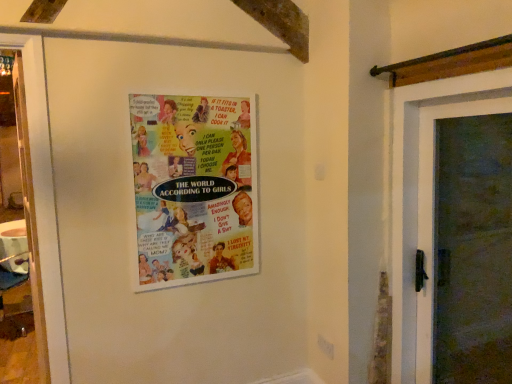
The height and width of the screenshot is (384, 512). Identify the location of multicolored paper poster at center. (194, 189).

In order to face multicolored paper poster at center, should I rotate leftwards or rightwards?

Turn left approximately 7.972 degrees to face it.

Describe the element at coordinates (194, 189) in the screenshot. The width and height of the screenshot is (512, 384). I see `multicolored paper poster at center` at that location.

The width and height of the screenshot is (512, 384). Describe the element at coordinates (425, 201) in the screenshot. I see `wooden door at right` at that location.

Find the location of a particular element. The width and height of the screenshot is (512, 384). wooden door at right is located at coordinates (425, 201).

This screenshot has width=512, height=384. Find the location of `multicolored paper poster at center`. multicolored paper poster at center is located at coordinates (194, 189).

Visually, is wooden door at right positioned to the left or to the right of multicolored paper poster at center?

Clearly, wooden door at right is on the right of multicolored paper poster at center in the image.

Is wooden door at right in front of or behind multicolored paper poster at center in the image?

Visually, wooden door at right is located in front of multicolored paper poster at center.

Which is in front, point (431, 205) or point (145, 250)?

The point (431, 205) is closer to the camera.

From the image's perspective, which one is positioned lower, wooden door at right or multicolored paper poster at center?

wooden door at right, from the image's perspective.

From a real-world perspective, is wooden door at right below multicolored paper poster at center?

Yes, from a real-world perspective, wooden door at right is under multicolored paper poster at center.

Considering the sizes of wooden door at right and multicolored paper poster at center in the image, is wooden door at right wider or thinner than multicolored paper poster at center?

Clearly, wooden door at right has more width compared to multicolored paper poster at center.

Between wooden door at right and multicolored paper poster at center, which one has more height?

Standing taller between the two is wooden door at right.

Who is bigger, wooden door at right or multicolored paper poster at center?

Bigger between the two is wooden door at right.

Would you say wooden door at right contains multicolored paper poster at center?

Actually, multicolored paper poster at center is outside wooden door at right.

Is wooden door at right beside multicolored paper poster at center?

wooden door at right is not next to multicolored paper poster at center, and they're not touching.

Is wooden door at right positioned with its back to multicolored paper poster at center?

No.

Identify the location of poster positioned vertically above the wooden door at right (from a real-world perspective). (194, 189).

Is multicolored paper poster at center at the right side of wooden door at right?

No.

Is multicolored paper poster at center in front of or behind wooden door at right in the image?

Clearly, multicolored paper poster at center is behind wooden door at right.

Between point (248, 249) and point (407, 329), which one is positioned behind?

The point (248, 249) is more distant.

From the image's perspective, is multicolored paper poster at center positioned above or below wooden door at right?

Clearly, from the image's perspective, multicolored paper poster at center is above wooden door at right.

From a real-world perspective, is multicolored paper poster at center located beneath wooden door at right?

No, from a real-world perspective, multicolored paper poster at center is not beneath wooden door at right.

Based on the photo, considering the sizes of multicolored paper poster at center and wooden door at right in the image, is multicolored paper poster at center wider or thinner than wooden door at right?

Considering their sizes, multicolored paper poster at center looks slimmer than wooden door at right.

Considering the relative sizes of multicolored paper poster at center and wooden door at right in the image provided, is multicolored paper poster at center taller than wooden door at right?

In fact, multicolored paper poster at center may be shorter than wooden door at right.

In the scene shown: Considering the sizes of objects multicolored paper poster at center and wooden door at right in the image provided, who is bigger, multicolored paper poster at center or wooden door at right?

With larger size is wooden door at right.

Is multicolored paper poster at center situated inside wooden door at right or outside?

multicolored paper poster at center cannot be found inside wooden door at right.

Is multicolored paper poster at center far from wooden door at right?

No.

Is wooden door at right at the back of multicolored paper poster at center?

No, wooden door at right is not at the back of multicolored paper poster at center.

What's the angular difference between multicolored paper poster at center and wooden door at right's facing directions?

90.3 degrees.

Find the location of `poster lying above the wooden door at right (from the image's perspective)`. poster lying above the wooden door at right (from the image's perspective) is located at coordinates (194, 189).

The height and width of the screenshot is (384, 512). In order to click on door lying on the right of multicolored paper poster at center in this screenshot , I will do `click(425, 201)`.

I want to click on poster lying above the wooden door at right (from the image's perspective), so click(194, 189).